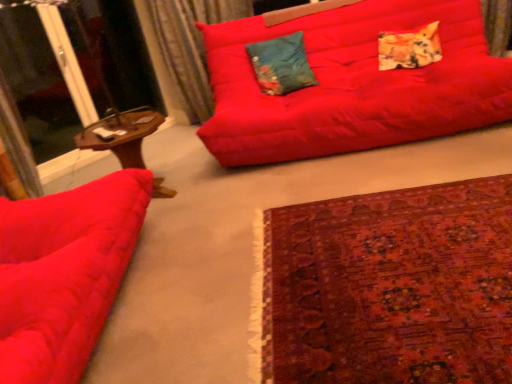
The image size is (512, 384). Find the location of `vacant space behind carpet with intricate patterns at lower right`. vacant space behind carpet with intricate patterns at lower right is located at coordinates (340, 168).